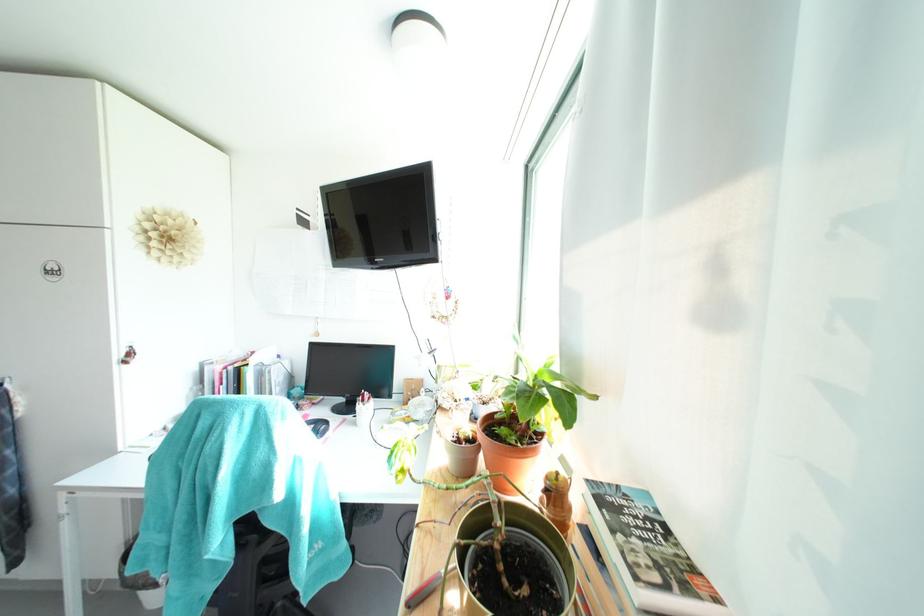
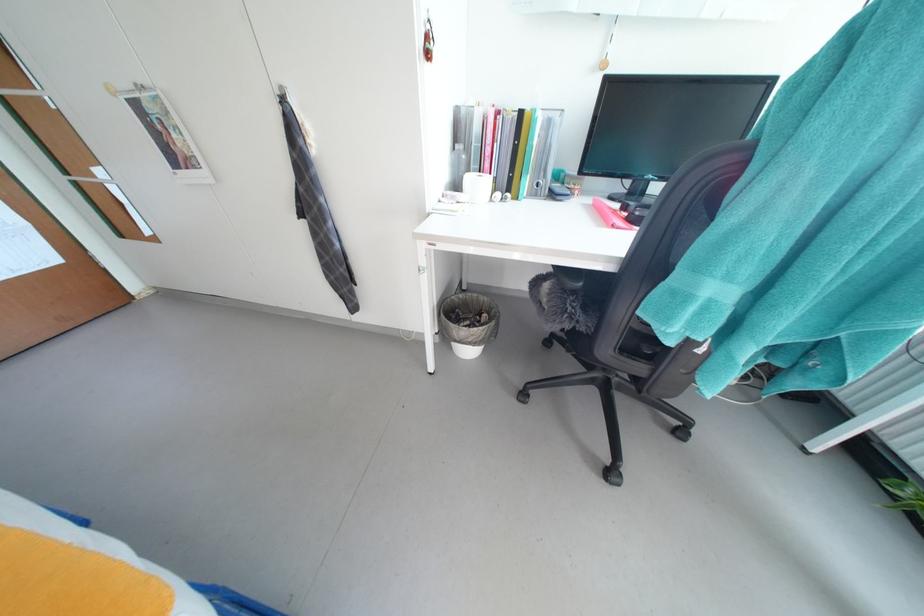
The point at (149, 585) is marked in the first image. Where is the corresponding point in the second image?

(478, 342)